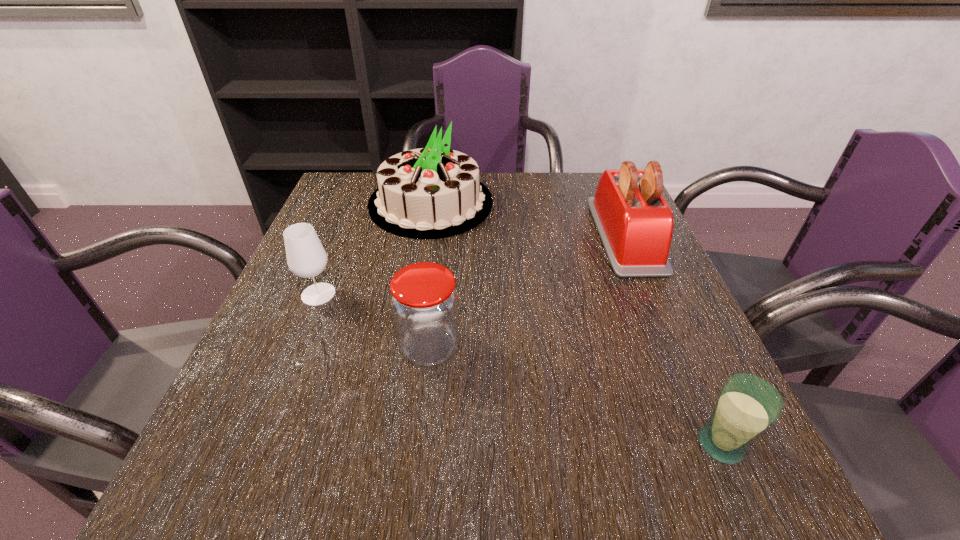
What are the coordinates of `object located in the far right corner section of the desktop` in the screenshot? It's located at pos(635,223).

Find the location of `object that is at the near right corner`. object that is at the near right corner is located at coordinates [747, 406].

In the image, there is a desktop. Identify the location of free space at the far edge. (527, 212).

This screenshot has height=540, width=960. What are the coordinates of `free space at the near edge` in the screenshot? It's located at (455, 469).

Identify the location of free space at the left edge of the desktop. The height and width of the screenshot is (540, 960). (293, 293).

Where is `blank space at the right edge of the desktop`? This screenshot has height=540, width=960. blank space at the right edge of the desktop is located at coordinates (x=686, y=427).

In the image, there is a desktop. Identify the location of vacant space at the far left corner. (365, 179).

This screenshot has height=540, width=960. What are the coordinates of `vacant space at the far right corner` in the screenshot? It's located at (594, 195).

Locate an element on the screen. Image resolution: width=960 pixels, height=540 pixels. free space at the near right corner of the desktop is located at coordinates (740, 499).

You are a GUI agent. You are given a task and a screenshot of the screen. Output one action in this format:
    pyautogui.click(x=<x>, y=<y>)
    Task: Click on the vacant point located between the nearest object and the birthday cake
    The height and width of the screenshot is (540, 960).
    Given the screenshot: What is the action you would take?
    pyautogui.click(x=576, y=323)